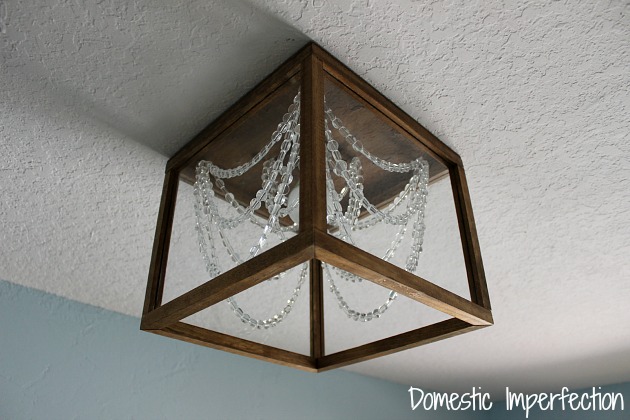
Find the location of `ceiling`. ceiling is located at coordinates (99, 210).